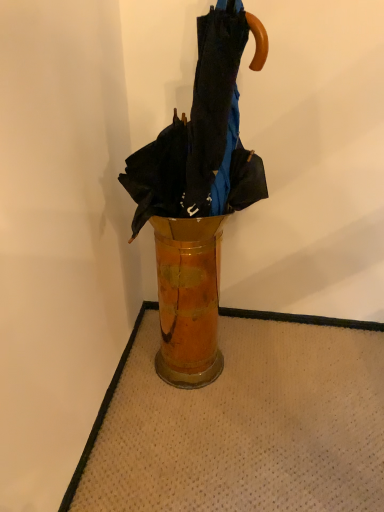
Question: Considering the relative positions of shiny metallic umbrella at center and wooden vase at center in the image provided, is shiny metallic umbrella at center to the left or to the right of wooden vase at center?

Choices:
 (A) right
 (B) left

Answer: (A)

Question: From the image's perspective, is shiny metallic umbrella at center positioned above or below wooden vase at center?

Choices:
 (A) below
 (B) above

Answer: (B)

Question: Based on their sizes in the image, would you say shiny metallic umbrella at center is bigger or smaller than wooden vase at center?

Choices:
 (A) big
 (B) small

Answer: (A)

Question: Looking at their shapes, would you say wooden vase at center is wider or thinner than shiny metallic umbrella at center?

Choices:
 (A) thin
 (B) wide

Answer: (A)

Question: From their relative heights in the image, would you say wooden vase at center is taller or shorter than shiny metallic umbrella at center?

Choices:
 (A) tall
 (B) short

Answer: (B)

Question: Visually, is wooden vase at center positioned to the left or to the right of shiny metallic umbrella at center?

Choices:
 (A) right
 (B) left

Answer: (B)

Question: From the image's perspective, is wooden vase at center positioned above or below shiny metallic umbrella at center?

Choices:
 (A) below
 (B) above

Answer: (A)